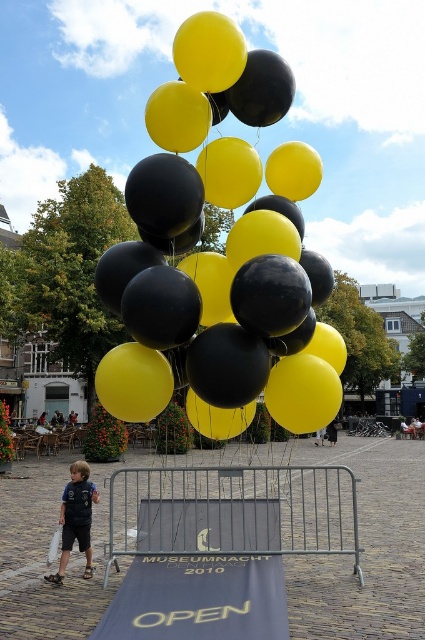
Is metallic silver barricade at center closer to the viewer compared to matte blue shirt at lower left?

Yes.

Identify the location of metallic silver barricade at center. (232, 512).

Can you confirm if matte black balloon at center is shorter than blue fabric ramp at center?

Incorrect, matte black balloon at center's height does not fall short of blue fabric ramp at center's.

Who is more distant from viewer, (283, 410) or (255, 616)?

The point (283, 410) is more distant.

Is point (127, 349) positioned in front of point (248, 563)?

Yes, point (127, 349) is closer to viewer.

Locate an element on the screen. This screenshot has width=425, height=640. matte black balloon at center is located at coordinates (221, 253).

Does metallic silver barricade at center have a lesser height compared to blue fabric ramp at center?

Incorrect, metallic silver barricade at center's height does not fall short of blue fabric ramp at center's.

Does metallic silver barricade at center have a greater height compared to blue fabric ramp at center?

Indeed, metallic silver barricade at center has a greater height compared to blue fabric ramp at center.

This screenshot has width=425, height=640. Describe the element at coordinates (232, 512) in the screenshot. I see `metallic silver barricade at center` at that location.

What are the coordinates of `metallic silver barricade at center` in the screenshot? It's located at (232, 512).